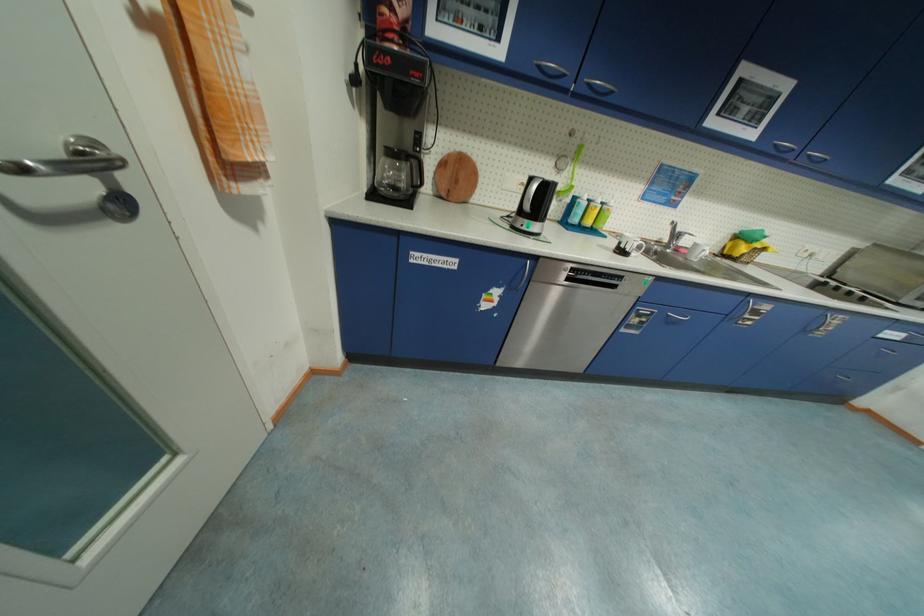
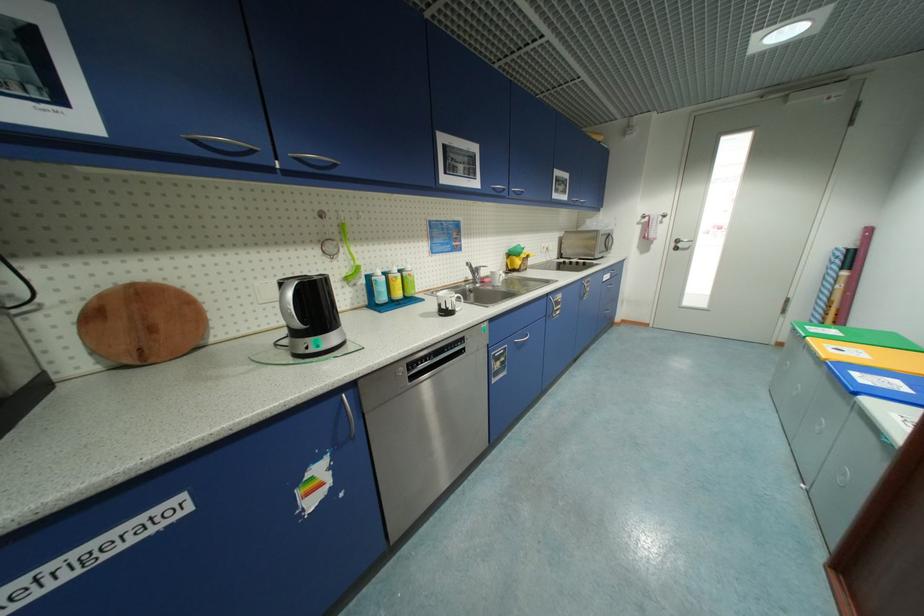
Question: Based on the continuous images, in which direction is the camera rotating? Reply with the corresponding letter.

Choices:
 (A) Left
 (B) Right
 (C) Up
 (D) Down

Answer: (B)